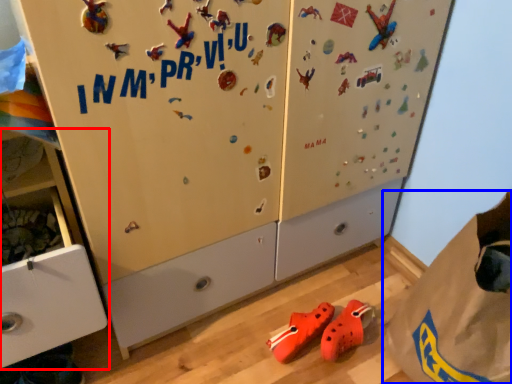
Question: Among these objects, which one is nearest to the camera, cabinetry (highlighted by a red box) or paper bag (highlighted by a blue box)?

Choices:
 (A) cabinetry
 (B) paper bag

Answer: (A)